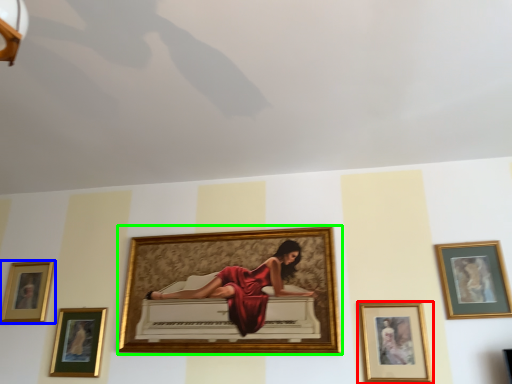
Question: Which is nearer to the picture frame (highlighted by a red box)? picture frame (highlighted by a blue box) or picture frame (highlighted by a green box).

Choices:
 (A) picture frame
 (B) picture frame

Answer: (B)